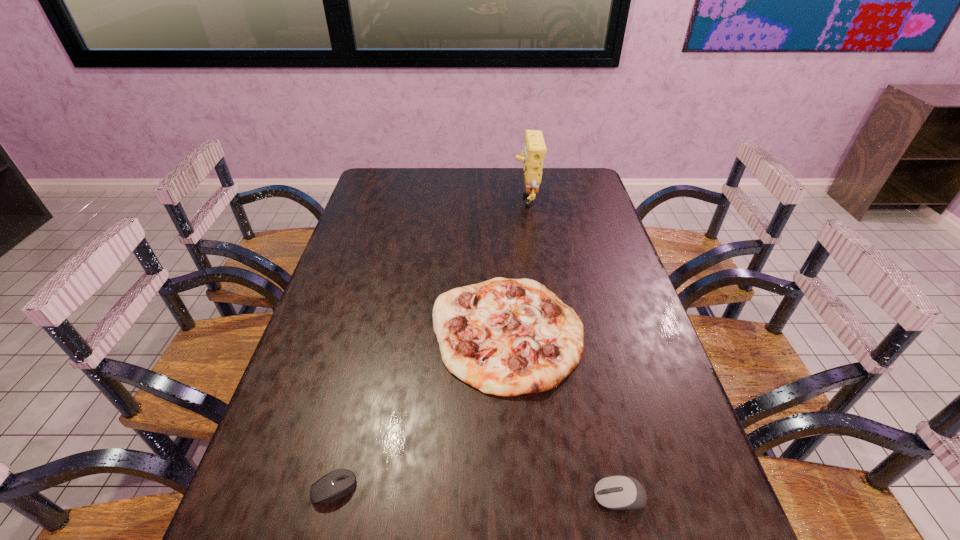
Find the location of `free spot located 0.170m on the face of the tallest object`. free spot located 0.170m on the face of the tallest object is located at coordinates (468, 198).

Identify the location of free spot located 0.100m on the left of the second tallest object. [394, 332].

You are a GUI agent. You are given a task and a screenshot of the screen. Output one action in this format:
    pyautogui.click(x=<x>, y=<y>)
    Task: Click on the free space located on the wheel side of the taller computer equipment
    The width and height of the screenshot is (960, 540).
    Given the screenshot: What is the action you would take?
    pyautogui.click(x=504, y=497)

At what (x,y) coordinates should I click in order to perform the action: click on free space located 0.140m on the wheel side of the taller computer equipment. Please return your answer as a coordinate pair (x, y). The height and width of the screenshot is (540, 960). Looking at the image, I should click on (520, 497).

Identify the location of blank space located 0.220m on the wheel side of the taller computer equipment. (478, 497).

Identify the location of vacant area situated on the right of the shortest object. The image size is (960, 540). (485, 489).

I want to click on object that is positioned at the far edge, so click(x=533, y=155).

Identify the location of object that is at the left edge. (337, 484).

Where is `object that is at the right edge`? object that is at the right edge is located at coordinates (618, 492).

Where is `vacant space at the far edge of the desktop`? vacant space at the far edge of the desktop is located at coordinates (440, 179).